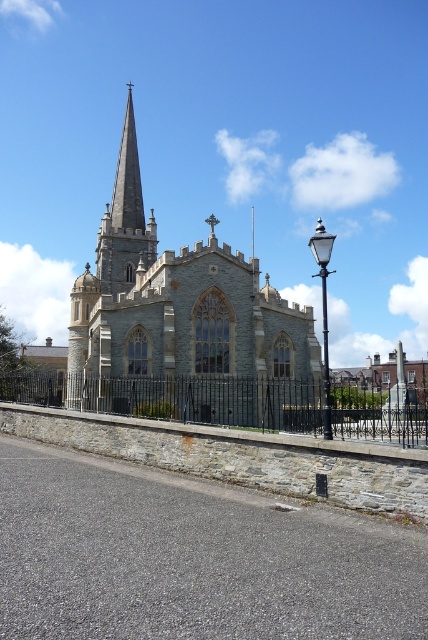
Question: Can you confirm if black wrought iron fence at center is positioned below smooth gray steeple at center?

Choices:
 (A) yes
 (B) no

Answer: (A)

Question: Which point is closer to the camera taking this photo?

Choices:
 (A) (145, 266)
 (B) (267, 394)
 (C) (228, 260)

Answer: (B)

Question: Is gray stone church at center closer to camera compared to smooth gray steeple at center?

Choices:
 (A) no
 (B) yes

Answer: (B)

Question: Considering the relative positions of gray stone church at center and smooth gray steeple at center in the image provided, where is gray stone church at center located with respect to smooth gray steeple at center?

Choices:
 (A) right
 (B) left

Answer: (A)

Question: Which point is closer to the camera?

Choices:
 (A) black wrought iron fence at center
 (B) gray stone church at center
 (C) smooth gray steeple at center

Answer: (B)

Question: Which object appears closest to the camera in this image?

Choices:
 (A) gray stone church at center
 (B) smooth gray steeple at center

Answer: (A)